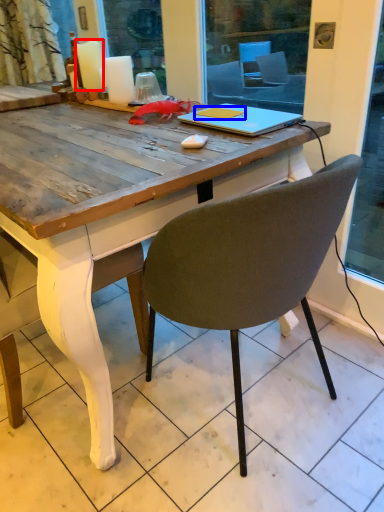
Question: Which point is further to the camera, candle (highlighted by a red box) or notebook (highlighted by a blue box)?

Choices:
 (A) candle
 (B) notebook

Answer: (A)